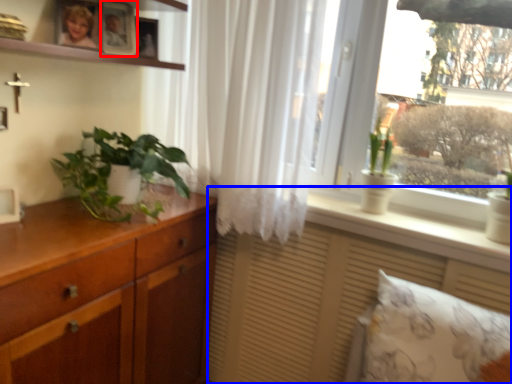
Question: Which of the following is the farthest to the observer, picture frame (highlighted by a red box) or vanity (highlighted by a blue box)?

Choices:
 (A) picture frame
 (B) vanity

Answer: (A)